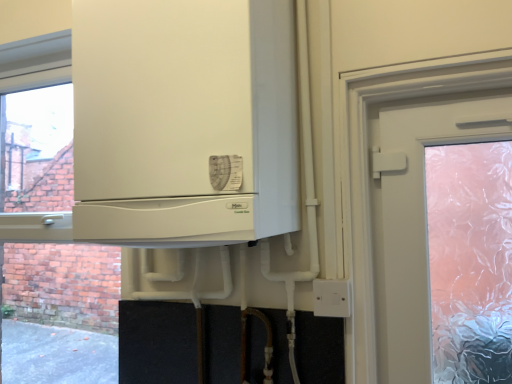
Question: Considering the relative positions of white matte cabinet at center and white plastic electric outlet at lower right in the image provided, is white matte cabinet at center to the left or to the right of white plastic electric outlet at lower right?

Choices:
 (A) right
 (B) left

Answer: (B)

Question: From a real-world perspective, relative to white plastic electric outlet at lower right, is white matte cabinet at center vertically above or below?

Choices:
 (A) below
 (B) above

Answer: (B)

Question: Would you say white matte cabinet at center is inside or outside white plastic electric outlet at lower right?

Choices:
 (A) outside
 (B) inside

Answer: (A)

Question: Considering the positions of point (344, 301) and point (233, 168), is point (344, 301) closer or farther from the camera than point (233, 168)?

Choices:
 (A) farther
 (B) closer

Answer: (A)

Question: Visually, is white plastic electric outlet at lower right positioned to the left or to the right of white matte cabinet at center?

Choices:
 (A) left
 (B) right

Answer: (B)

Question: Considering the positions of white plastic electric outlet at lower right and white matte cabinet at center in the image, is white plastic electric outlet at lower right taller or shorter than white matte cabinet at center?

Choices:
 (A) tall
 (B) short

Answer: (B)

Question: Do you think white plastic electric outlet at lower right is within white matte cabinet at center, or outside of it?

Choices:
 (A) outside
 (B) inside

Answer: (A)